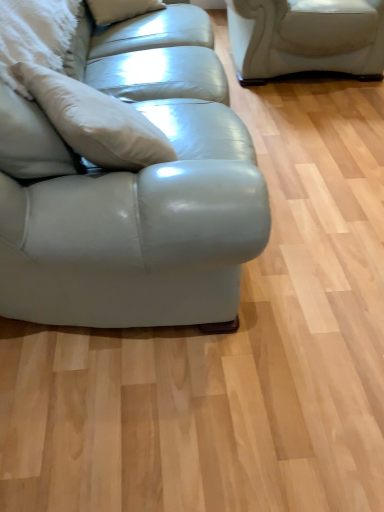
Question: Would you say satin beige couch at left is to the left or to the right of white fluffy pillow at left in the picture?

Choices:
 (A) right
 (B) left

Answer: (A)

Question: Choose the correct answer: Is satin beige couch at left inside white fluffy pillow at left or outside it?

Choices:
 (A) outside
 (B) inside

Answer: (A)

Question: From a real-world perspective, is satin beige couch at left physically located above or below white fluffy pillow at left?

Choices:
 (A) above
 (B) below

Answer: (B)

Question: Relative to satin beige couch at left, is white fluffy pillow at left in front or behind?

Choices:
 (A) front
 (B) behind

Answer: (B)

Question: From a real-world perspective, relative to satin beige couch at left, is white fluffy pillow at left vertically above or below?

Choices:
 (A) above
 (B) below

Answer: (A)

Question: Would you say white fluffy pillow at left is inside or outside satin beige couch at left?

Choices:
 (A) outside
 (B) inside

Answer: (A)

Question: From the image's perspective, is white fluffy pillow at left located above or below satin beige couch at left?

Choices:
 (A) above
 (B) below

Answer: (A)